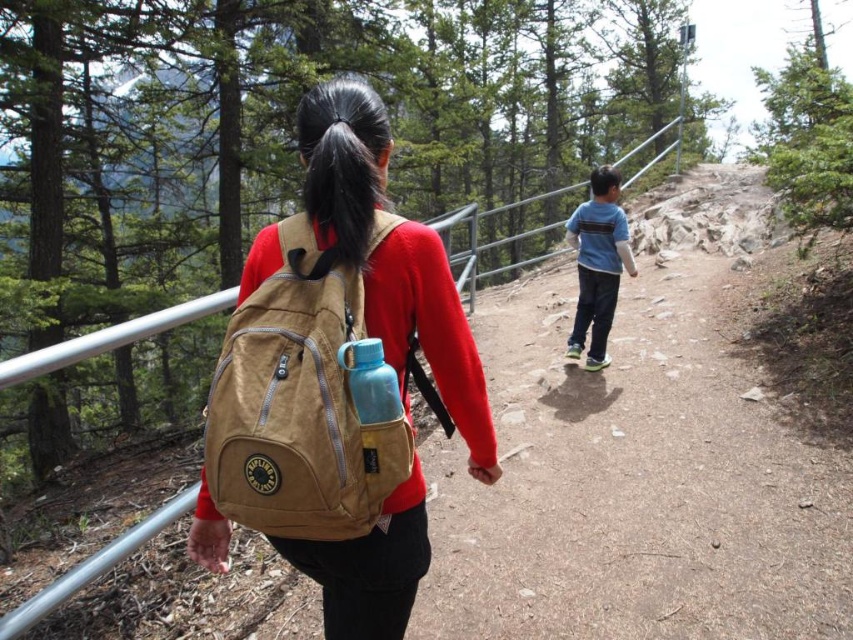
Which is behind, point (320, 179) or point (368, 477)?

The point (320, 179) is behind.

Is the position of black hair at upper center more distant than that of blue matte water bottle at back?

Yes, black hair at upper center is further from the viewer.

This screenshot has width=853, height=640. I want to click on black hair at upper center, so click(343, 173).

Is brown canvas backpack at center shorter than blue cotton shirt at center?

Yes.

Does brown canvas backpack at center lie in front of blue cotton shirt at center?

Yes, it is in front of blue cotton shirt at center.

Does point (437, 349) come closer to viewer compared to point (608, 218)?

Yes.

Image resolution: width=853 pixels, height=640 pixels. I want to click on brown canvas backpack at center, so click(430, 332).

Is brown canvas backpack at center below blue matte water bottle at back?

Incorrect, brown canvas backpack at center is not positioned below blue matte water bottle at back.

Is point (331, 616) closer to viewer compared to point (360, 381)?

No.

Between point (358, 241) and point (363, 394), which one is positioned behind?

The point (358, 241) is more distant.

Image resolution: width=853 pixels, height=640 pixels. Find the location of `brown canvas backpack at center`. brown canvas backpack at center is located at coordinates (430, 332).